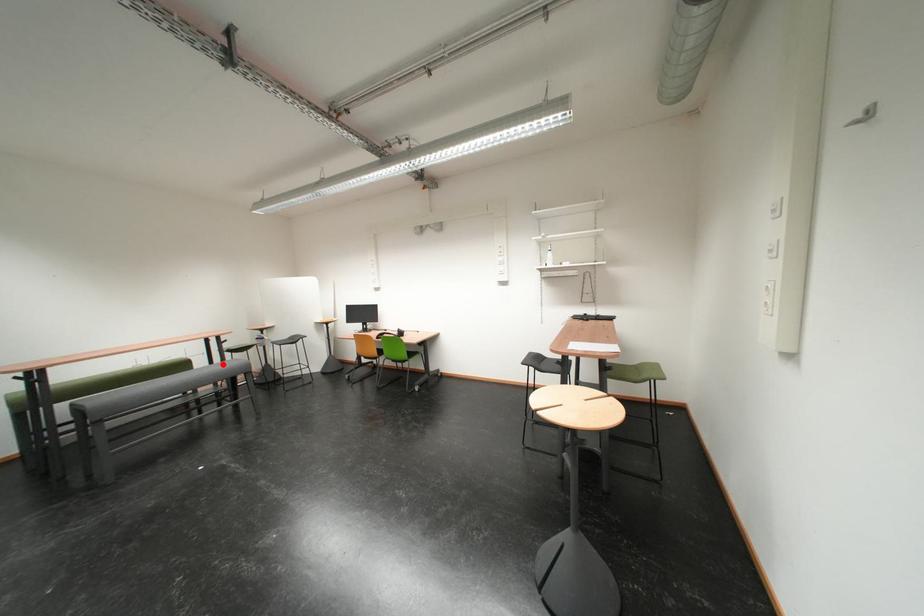
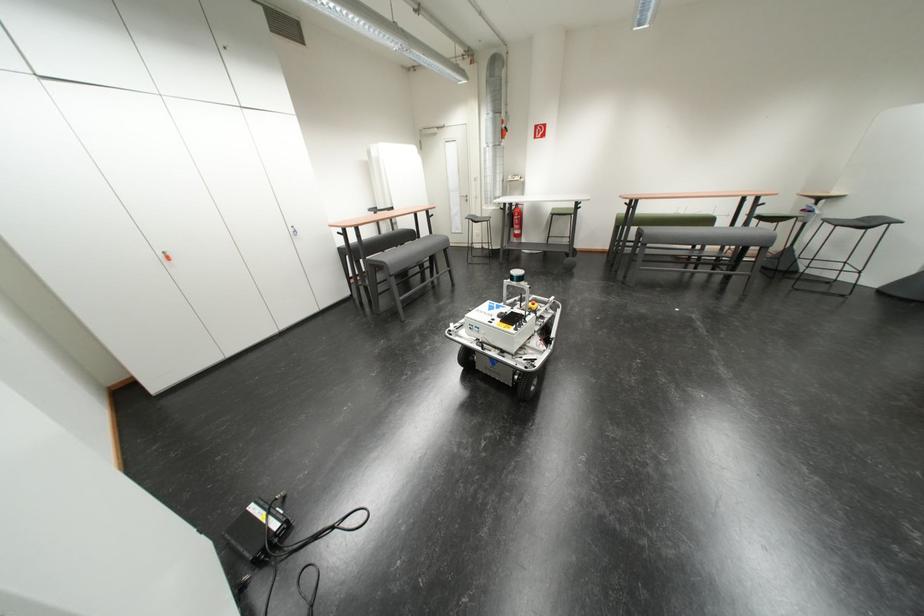
Find the pixel in the second image that matches the highlighted location in the first image.

(744, 228)